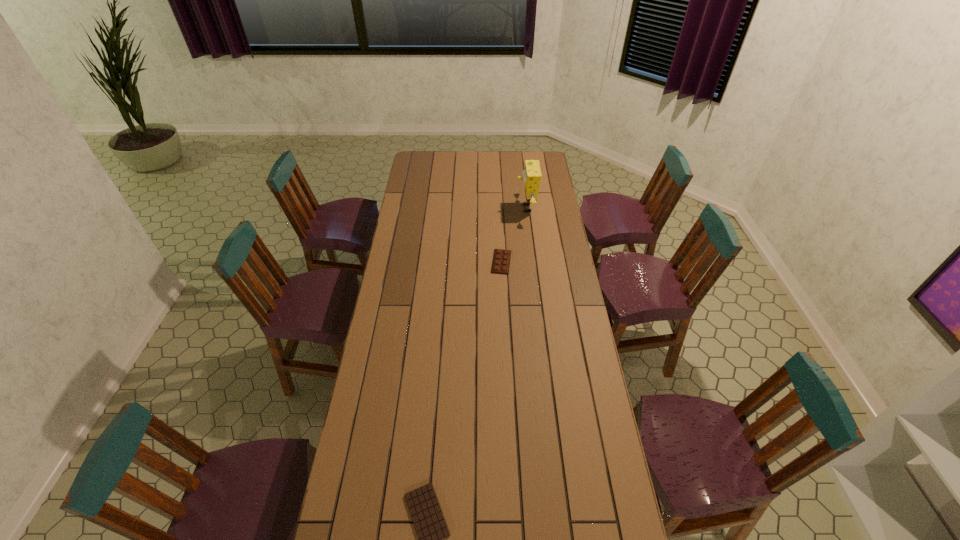
Identify the location of free space at the right edge of the desktop. Image resolution: width=960 pixels, height=540 pixels. (618, 496).

Locate an element on the screen. vacant region at the far right corner of the desktop is located at coordinates (549, 159).

This screenshot has width=960, height=540. I want to click on unoccupied position between the farthest object and the taller chocolate bar, so click(514, 235).

Locate which object ranks second in proximity to the sponge. Please provide its 2D coordinates. Your answer should be formatted as a tuple, i.e. [(x, y)], where the tuple contains the x and y coordinates of a point satisfying the conditions above.

[(431, 528)]

Find the location of a particular element. Image resolution: width=960 pixels, height=540 pixels. object that stands as the second closest to the shorter chocolate bar is located at coordinates (532, 175).

Where is `vacant area in the image that satisfies the following two spatial constraints: 1. on the front-facing side of the rightmost object; 2. on the front side of the farther chocolate bar`? This screenshot has height=540, width=960. vacant area in the image that satisfies the following two spatial constraints: 1. on the front-facing side of the rightmost object; 2. on the front side of the farther chocolate bar is located at coordinates (533, 262).